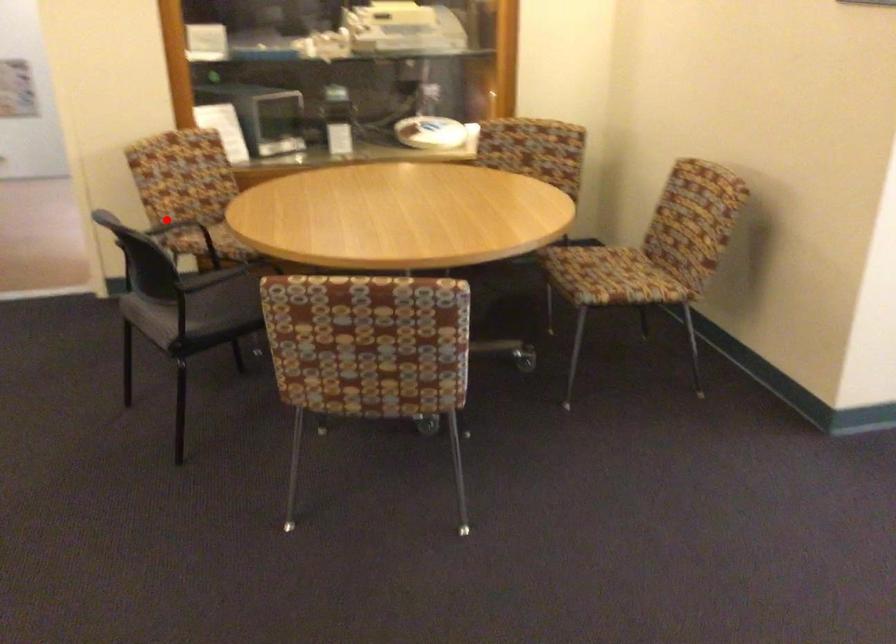
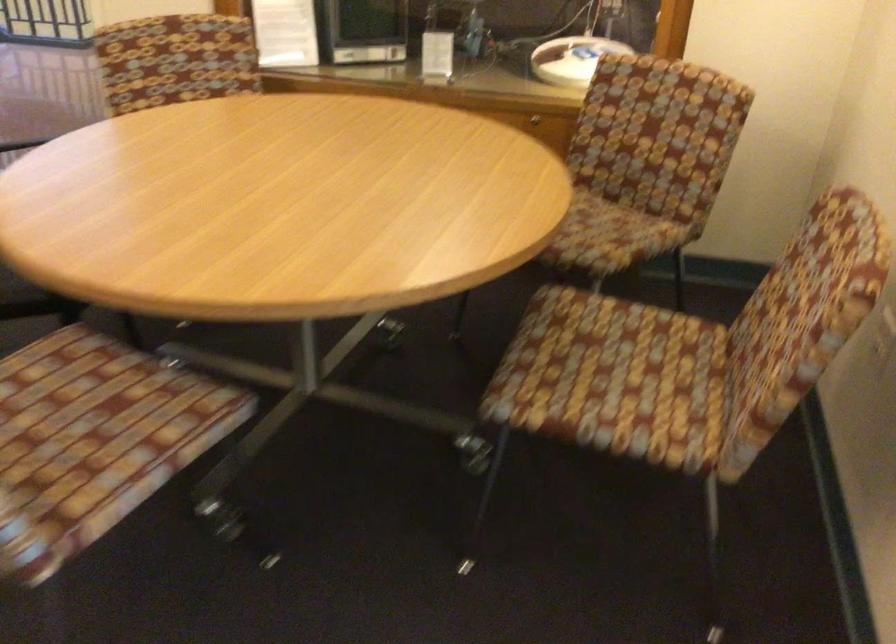
Question: I am providing you with two images of the same scene from different viewpoints. A red point is marked on the first image. Can you still see the location of the red point in image 2?

Choices:
 (A) Yes
 (B) No

Answer: (B)